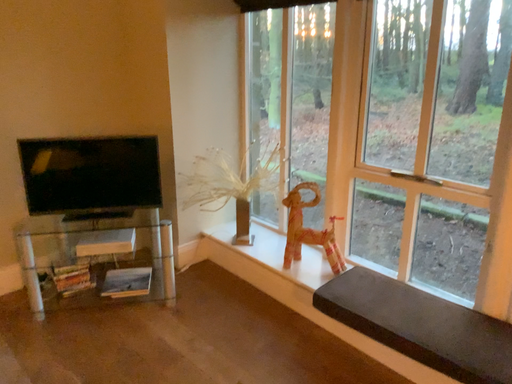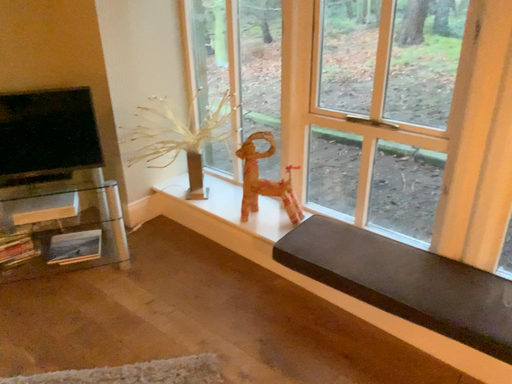
Question: How did the camera likely rotate when shooting the video?

Choices:
 (A) rotated upward
 (B) rotated downward

Answer: (B)